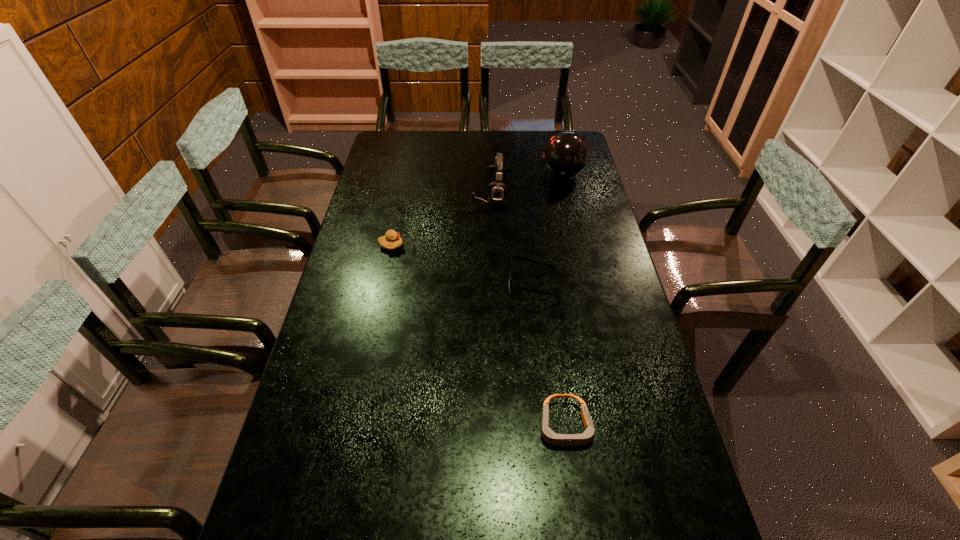
At what (x,y) coordinates should I click in order to perform the action: click on bowling ball. Please return your answer as a coordinate pair (x, y). This screenshot has width=960, height=540. Looking at the image, I should click on (566, 154).

Find the location of a particular element. Image resolution: width=960 pixels, height=540 pixels. headset is located at coordinates (496, 174).

Locate an element on the screen. This screenshot has height=540, width=960. duckling is located at coordinates (391, 241).

The height and width of the screenshot is (540, 960). Find the location of `the third farthest object`. the third farthest object is located at coordinates (391, 241).

Find the location of `the second shortest object`. the second shortest object is located at coordinates (511, 287).

At what (x,y) coordinates should I click in order to perform the action: click on the second nearest object. Please return your answer as a coordinate pair (x, y). The image size is (960, 540). Looking at the image, I should click on (511, 287).

Where is `the shortest object`? the shortest object is located at coordinates (549, 436).

You are a GUI agent. You are given a task and a screenshot of the screen. Output one action in this format:
    pyautogui.click(x=<x>, y=<y>)
    Task: Click on the nearest object
    The height and width of the screenshot is (540, 960).
    Given the screenshot: What is the action you would take?
    pyautogui.click(x=549, y=436)

Identify the location of free space located on the surface of the bowling ball near the finger holes. The width and height of the screenshot is (960, 540). (458, 174).

What are the coordinates of `free space located 0.120m on the surface of the bowling ball near the finger holes` in the screenshot? It's located at click(513, 174).